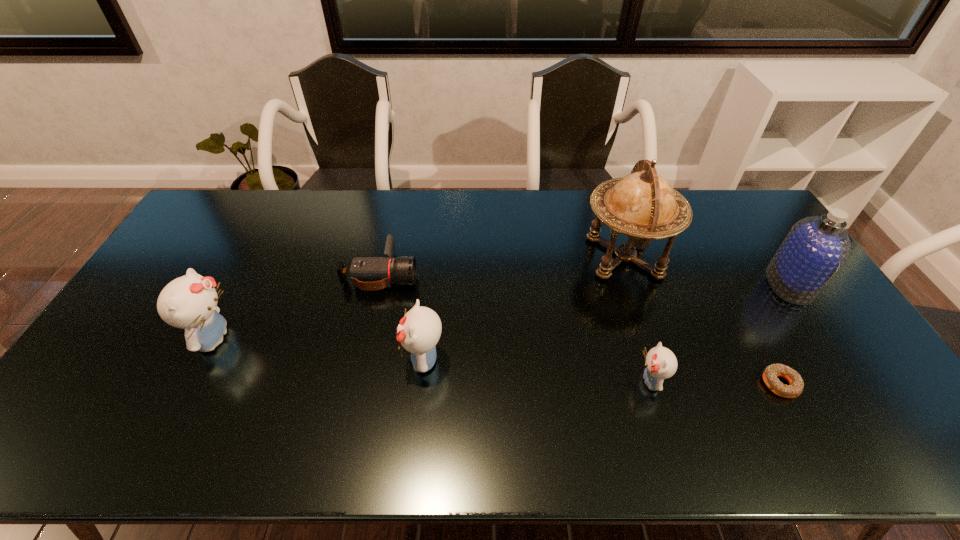
Where is `the leftmost object`? The height and width of the screenshot is (540, 960). the leftmost object is located at coordinates (189, 302).

Locate an element on the screen. The height and width of the screenshot is (540, 960). the second tallest kitten is located at coordinates click(419, 330).

Image resolution: width=960 pixels, height=540 pixels. Identify the location of the second kitten from right to left. (419, 330).

Locate an element on the screen. This screenshot has width=960, height=540. the shortest kitten is located at coordinates pos(661,363).

You are a GUI agent. You are given a task and a screenshot of the screen. Output one action in this format:
    pyautogui.click(x=<x>, y=<y>)
    Task: Click on the rightmost kitten
    The width and height of the screenshot is (960, 540).
    Given the screenshot: What is the action you would take?
    pyautogui.click(x=661, y=363)

This screenshot has width=960, height=540. I want to click on globe, so tap(642, 205).

Where is `the second tallest object`? the second tallest object is located at coordinates (816, 247).

Find the location of `cleansing agent`. cleansing agent is located at coordinates (816, 247).

Find the location of a particular element. camcorder is located at coordinates (367, 273).

At what (x,y) coordinates should I click in order to perform the action: click on doughnut. Please return your answer as a coordinate pair (x, y). Looking at the image, I should click on (770, 374).